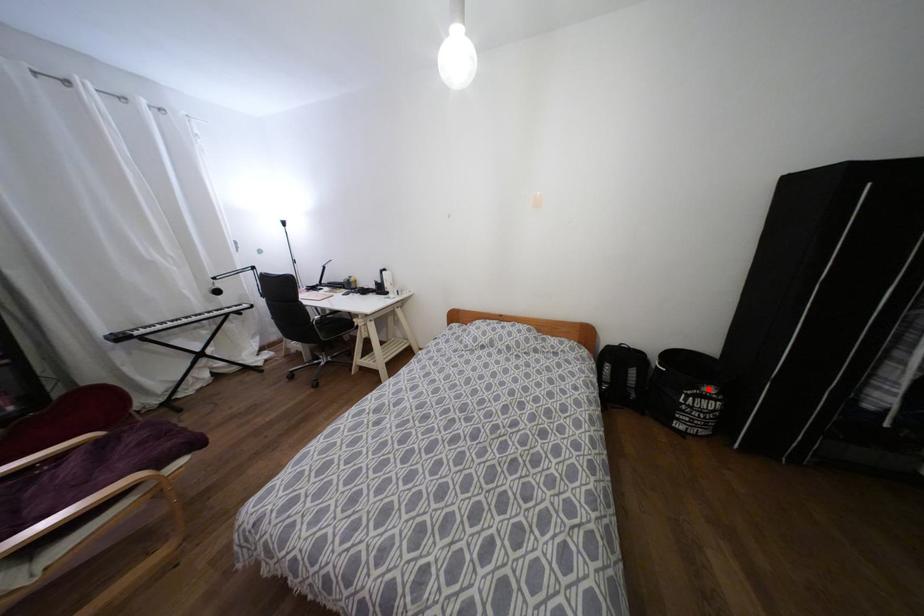
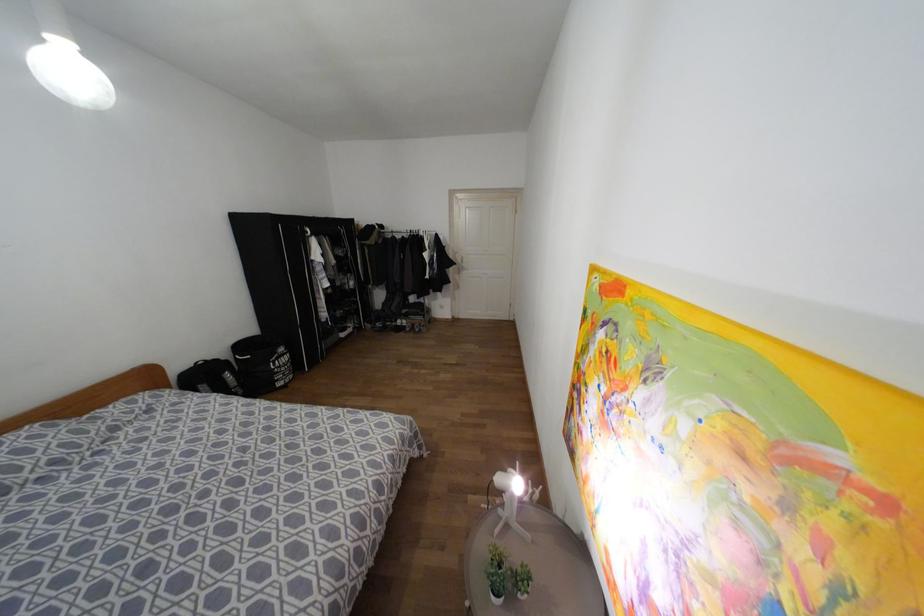
In the second image, find the point that corresponds to the highlighted location in the first image.

(281, 349)